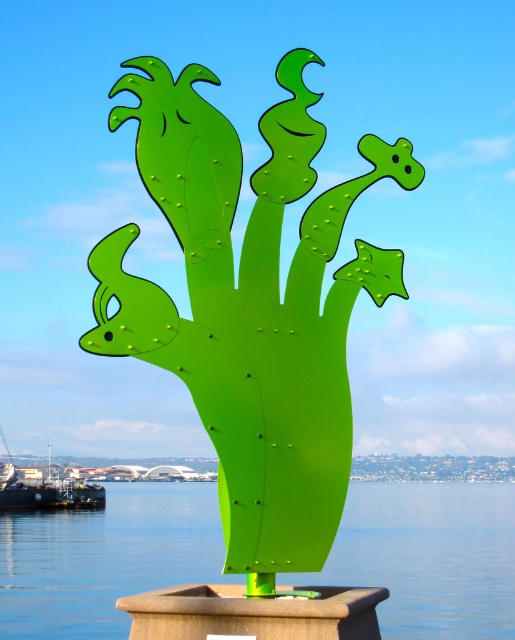
Question: Considering the relative positions of green metallic sculpture at center and green plastic water at center in the image provided, where is green metallic sculpture at center located with respect to green plastic water at center?

Choices:
 (A) above
 (B) below

Answer: (A)

Question: In this image, where is green metallic sculpture at center located relative to green plastic water at center?

Choices:
 (A) left
 (B) right

Answer: (A)

Question: Does green metallic sculpture at center have a smaller size compared to green plastic water at center?

Choices:
 (A) yes
 (B) no

Answer: (A)

Question: Which point is farther to the camera?

Choices:
 (A) (234, 294)
 (B) (111, 570)

Answer: (B)

Question: Which of the following is the farthest from the observer?

Choices:
 (A) green metallic sculpture at center
 (B) green plastic water at center

Answer: (A)